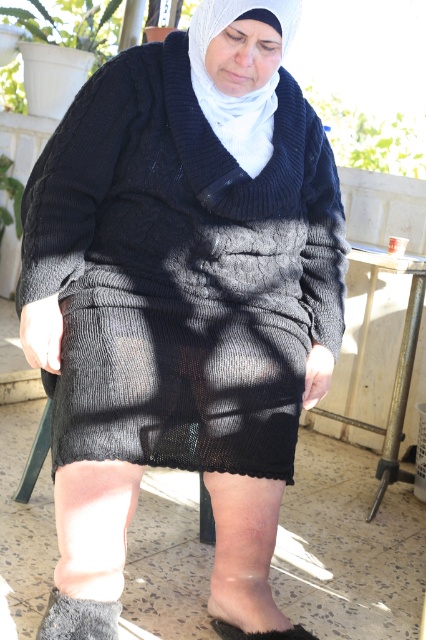
Who is more distant from viewer, (x=55, y=602) or (x=258, y=632)?

The point (x=258, y=632) is more distant.

Does point (92, 608) come farther from viewer compared to point (267, 634)?

No, (92, 608) is closer to viewer.

Between point (46, 616) and point (215, 618), which one is positioned behind?

Positioned behind is point (215, 618).

The image size is (426, 640). In order to click on gray fuzzy sock at lower left in this screenshot , I will do `click(78, 618)`.

Can you confirm if white knitted headscarf at center is wider than gray fuzzy sock at lower left?

Correct, the width of white knitted headscarf at center exceeds that of gray fuzzy sock at lower left.

Is point (222, 26) positioned in front of point (63, 609)?

Yes, it is.

In order to click on white knitted headscarf at center in this screenshot , I will do `click(242, 93)`.

Can you confirm if white knitted headscarf at center is positioned to the left of gray fabric foot at lower center?

Indeed, white knitted headscarf at center is positioned on the left side of gray fabric foot at lower center.

Is white knitted headscarf at center smaller than gray fabric foot at lower center?

No, white knitted headscarf at center is not smaller than gray fabric foot at lower center.

I want to click on white knitted headscarf at center, so click(242, 93).